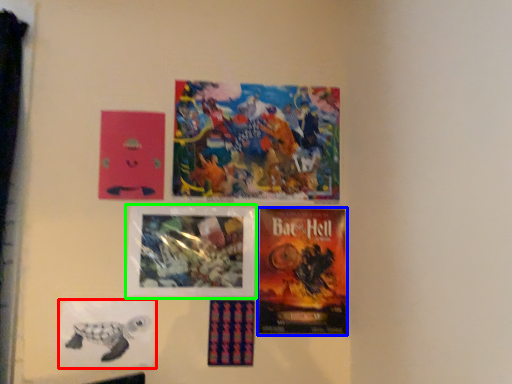
Question: Estimate the real-world distances between objects in this image. Which object is farther from poster (highlighted by a red box), poster (highlighted by a blue box) or poster (highlighted by a green box)?

Choices:
 (A) poster
 (B) poster

Answer: (A)